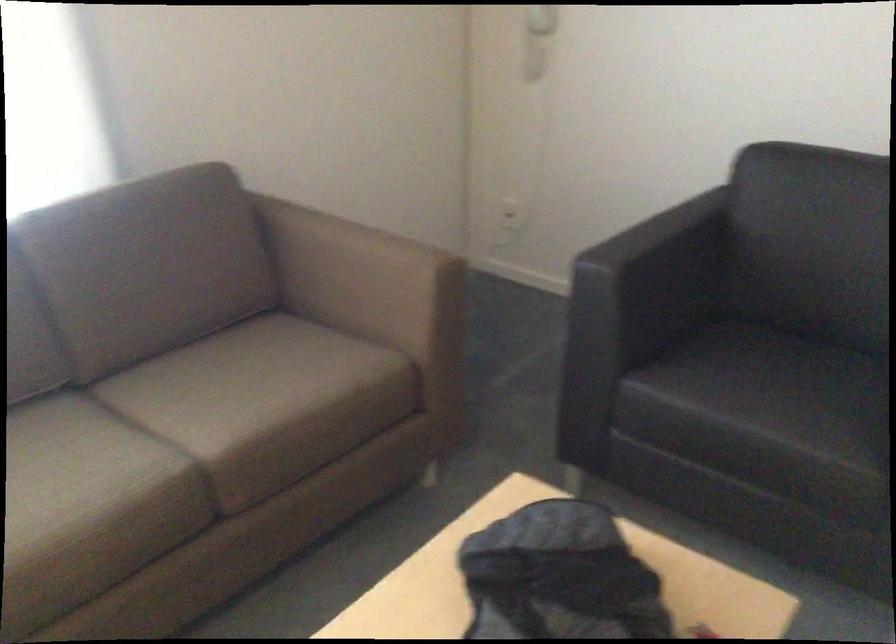
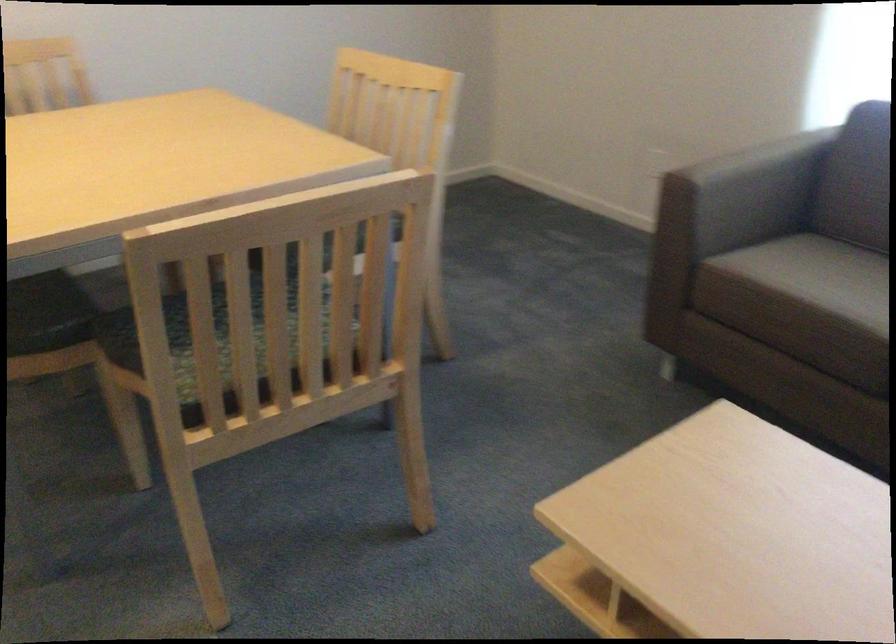
The images are taken continuously from a first-person perspective. In which direction is your viewpoint rotating?

The camera's rotation is toward left-down.